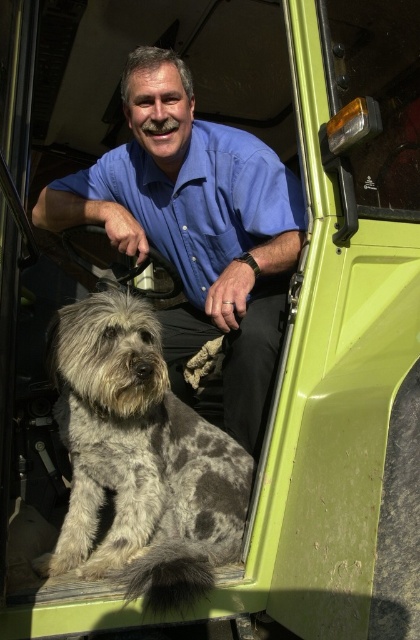
You are a photographer trying to take a clear picture of both the blue cotton shirt at center and the gray speckled fur dog at center. Which one should you focus on first to ensure it appears sharp in the photo?

You should focus on the blue cotton shirt at center first because it is closer to the viewer than the gray speckled fur dog at center, so focusing on the closer object first will help ensure both are in focus when using depth of field properly.

You are a photographer trying to capture a photo of the gray speckled fur dog at center and the blue cotton shirt at upper center. Which object should you focus on first if you want to ensure both are in focus, given that the camera can only focus on one object at a time?

You should focus on the gray speckled fur dog at center first because it is closer to the camera than the blue cotton shirt at upper center.

Based on the scene description, where is the gray speckled fur dog at center located in the image?

→ The gray speckled fur dog at center is located at point [139,460].